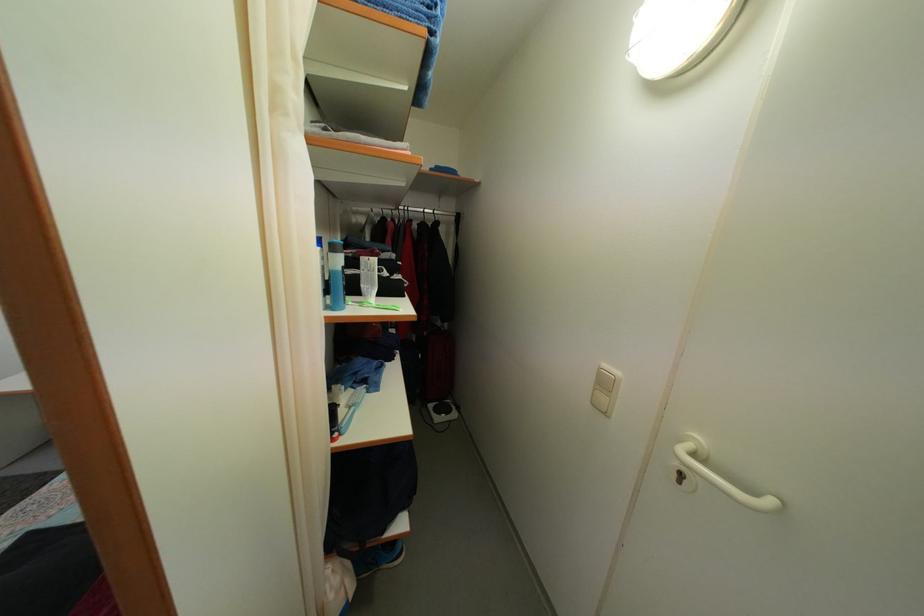
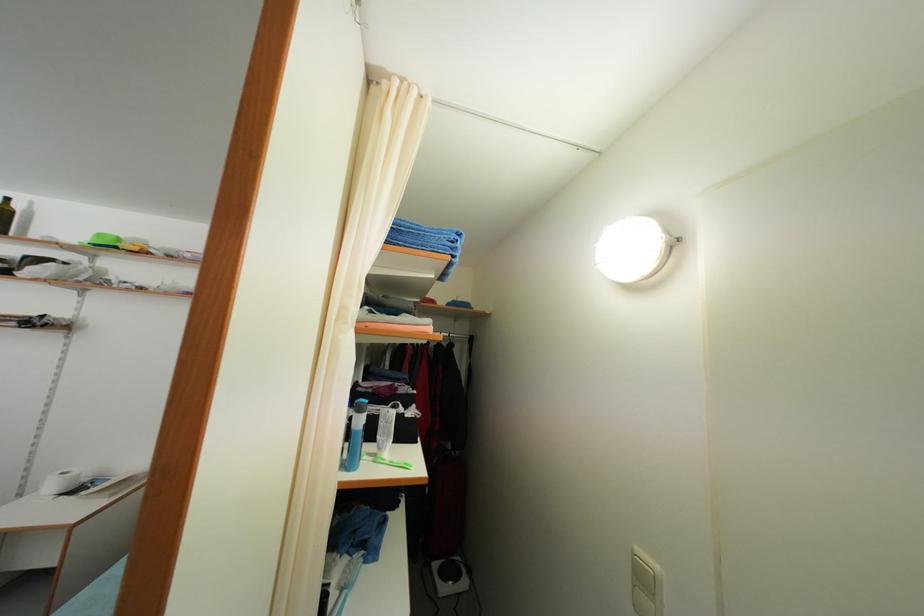
Locate, in the second image, the point that corresponds to point (368, 293) in the first image.

(383, 445)